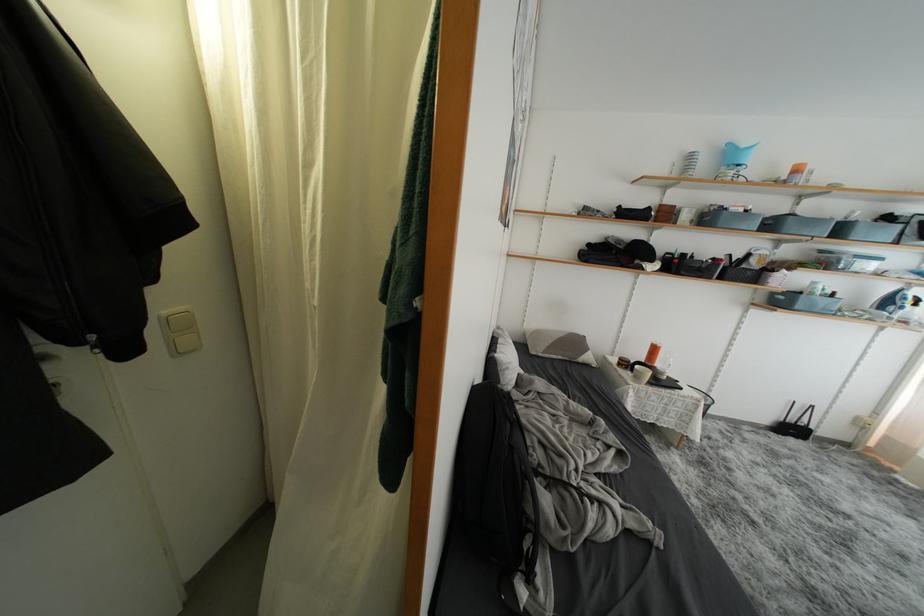
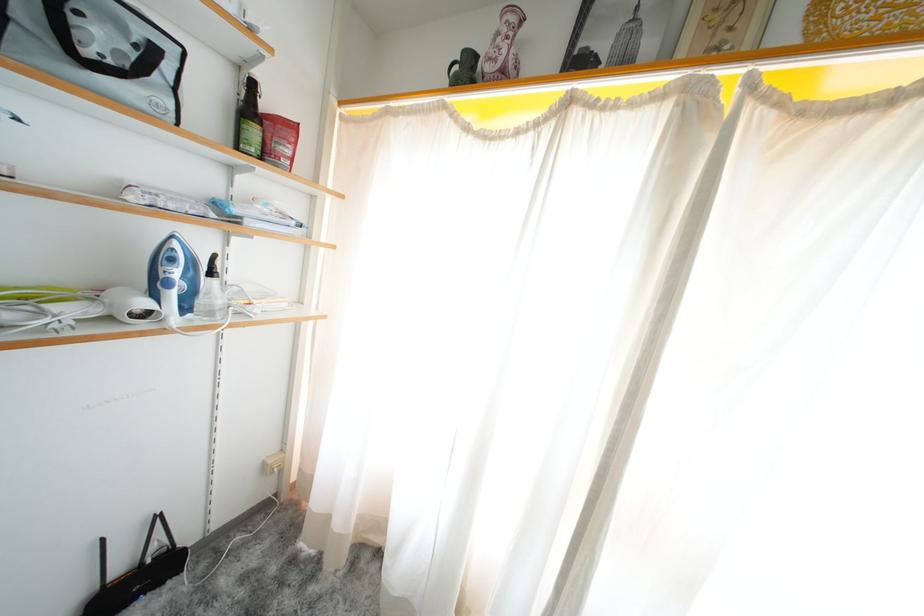
Locate, in the second image, the point that corresponds to (x=797, y=434) in the first image.

(143, 586)